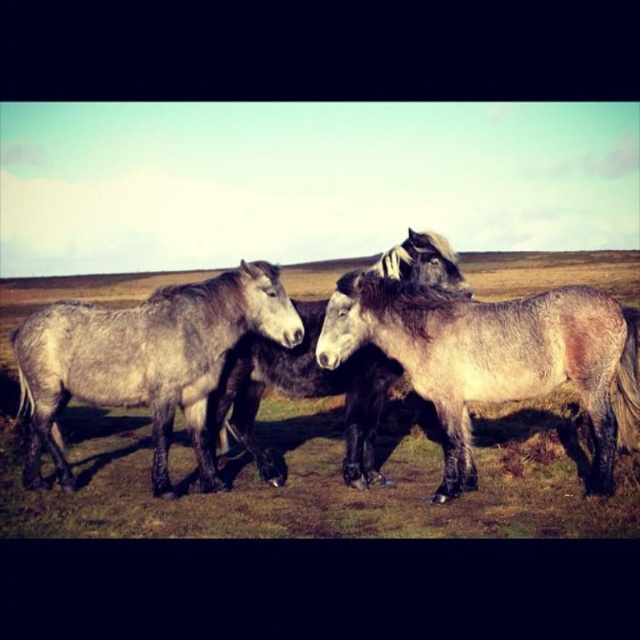
You are a farmer who wants to lead the gray textured horse at center and the gray woolen horse at left to a stable. Which horse do you need to bend down to pet before leading them?

The gray textured horse at center is shorter than the gray woolen horse at left, so you need to bend down to pet the gray textured horse at center since it is lower to the ground.

You are a photographer trying to capture the gray textured horse at center and the gray woolen horse at left in a single shot. Based on their positions, which horse is blocking the view of the other?

The gray textured horse at center is positioned under the gray woolen horse at left, so the gray woolen horse at left is blocking the view of the gray textured horse at center.

You are a photographer setting up equipment between the gray textured horse at center and the gray matte horse at center. You need to ensure there is enough space between them for your camera gear. Based on the scene description, can you determine if the space between the two horses is sufficient?

The gray textured horse at center might be wider than gray matte horse at center, so the space between them may not be sufficient for your camera gear. It is recommended to check the actual distance before setting up.